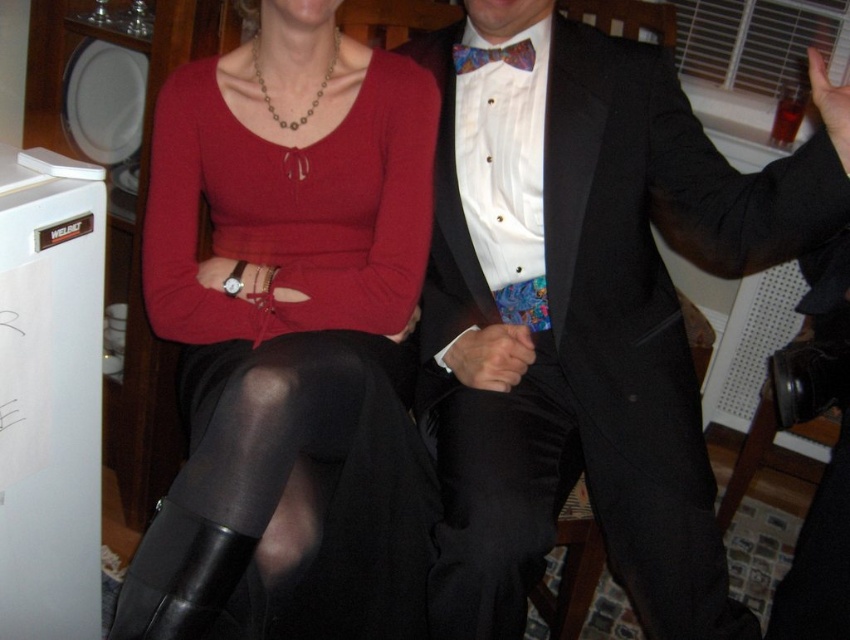
Question: Can you confirm if black satin pants at center is positioned to the left of white matte refrigerator at left?

Choices:
 (A) yes
 (B) no

Answer: (B)

Question: Which object is positioned closest to the shiny black suit at center?

Choices:
 (A) matte black hand at center
 (B) matte black tights at center
 (C) multicolored silk bow tie at center
 (D) matte black hand at upper right

Answer: (A)

Question: Which object is the farthest from the shiny black suit at center?

Choices:
 (A) multicolored silk bow tie at center
 (B) matte black hand at center
 (C) matte black tights at center

Answer: (A)

Question: Which point is farther to the camera?

Choices:
 (A) matte black hand at center
 (B) multicolored silk bow tie at center
 (C) white matte refrigerator at left

Answer: (A)

Question: Does matte black tights at center have a greater width compared to black satin pants at center?

Choices:
 (A) yes
 (B) no

Answer: (B)

Question: Is black sheer tights at lower center positioned at the back of matte black hand at center?

Choices:
 (A) yes
 (B) no

Answer: (B)